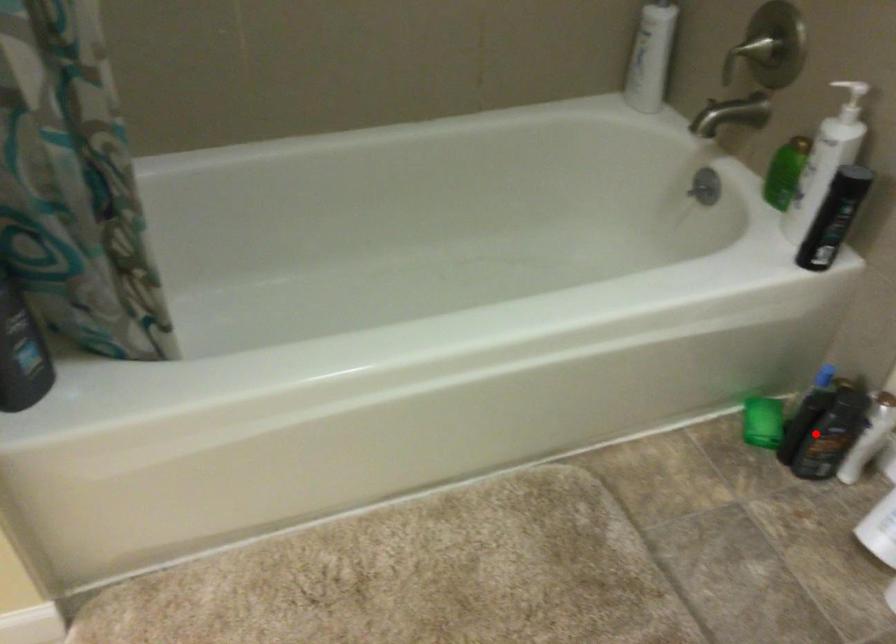
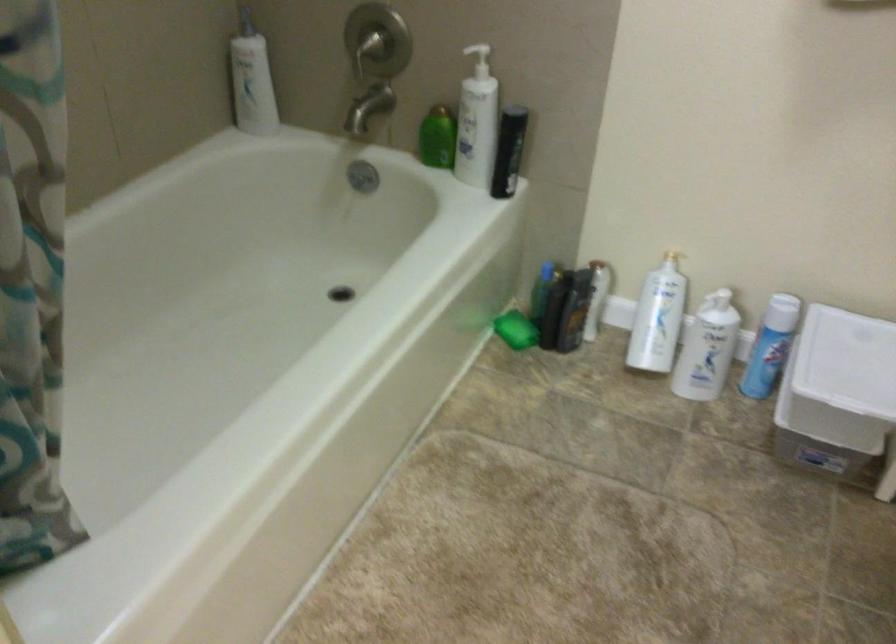
The point at the highlighted location is marked in the first image. Where is the corresponding point in the second image?

(574, 310)